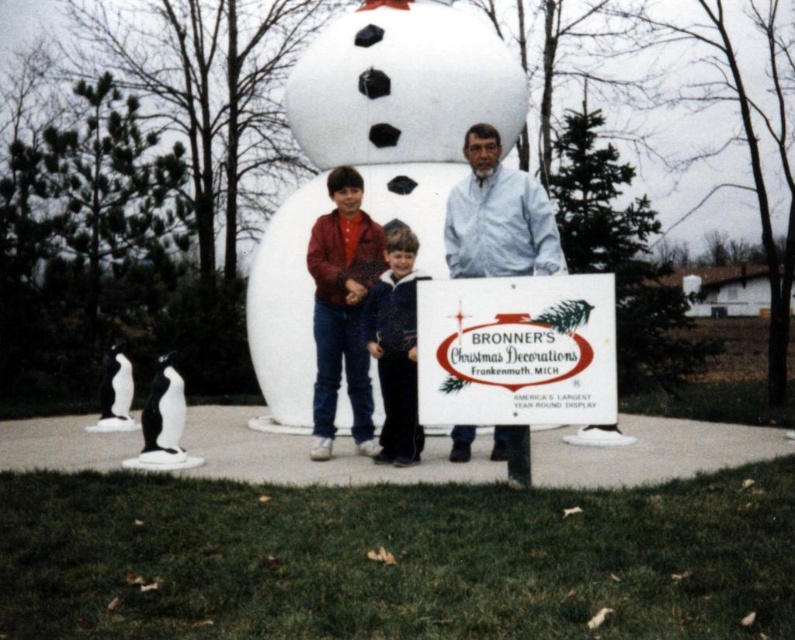
Question: Which of the following is the closest to the observer?

Choices:
 (A) white paper sign at center
 (B) white glossy penguin at lower left

Answer: (A)

Question: Which object appears closest to the camera in this image?

Choices:
 (A) white glossy penguin at lower left
 (B) white paper sign at center

Answer: (B)

Question: Observing the image, what is the correct spatial positioning of white paper sign at center in reference to white matte jacket at center?

Choices:
 (A) below
 (B) above

Answer: (A)

Question: Does white matte snowman at center lie behind black matte penguin at lower left?

Choices:
 (A) yes
 (B) no

Answer: (A)

Question: Which object appears closest to the camera in this image?

Choices:
 (A) white matte jacket at center
 (B) white paper sign at center
 (C) white matte snowman at center
 (D) black matte penguin at lower left

Answer: (B)

Question: From the image, what is the correct spatial relationship of black matte penguin at lower left in relation to white glossy penguin at lower left?

Choices:
 (A) left
 (B) right

Answer: (B)